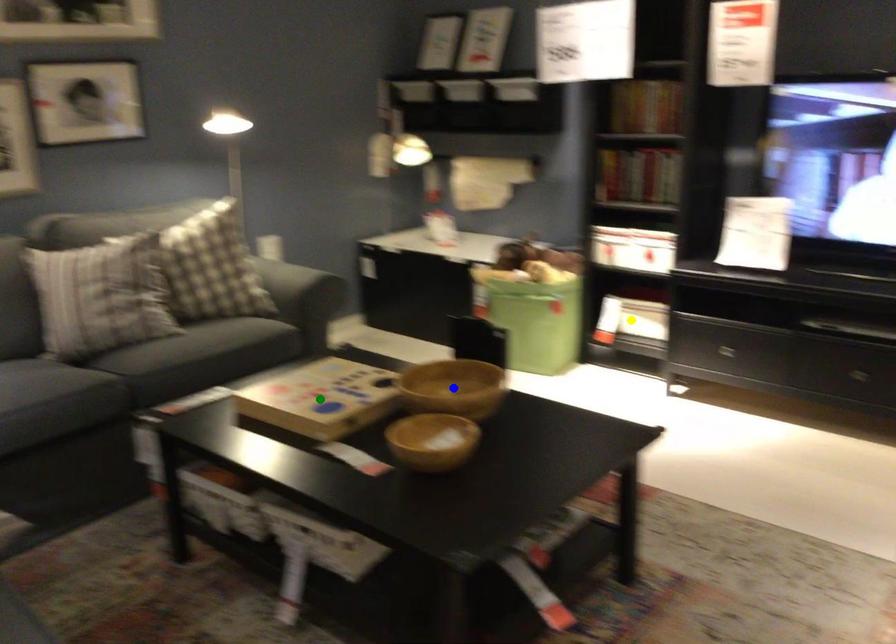
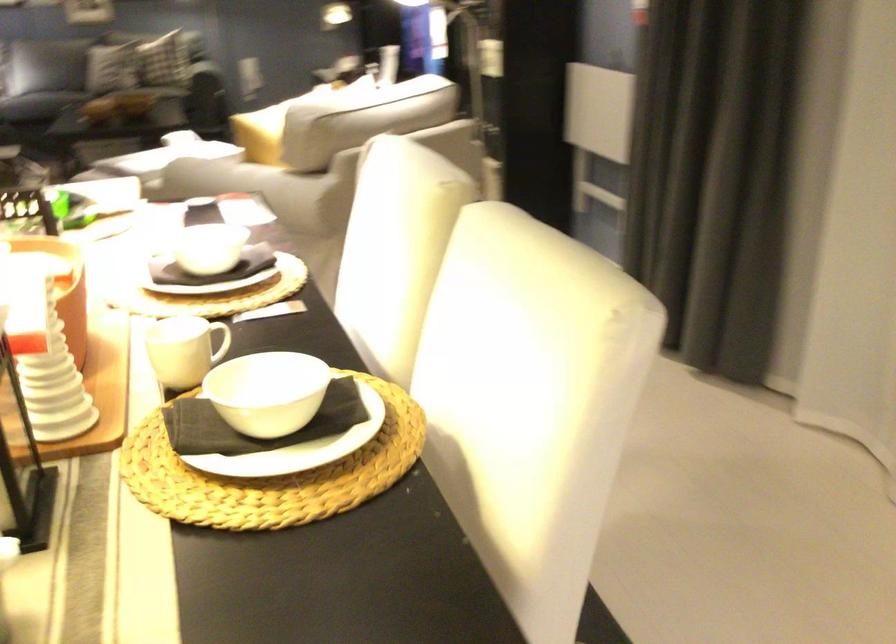
I am providing you with two images of the same scene from different viewpoints. Three points are marked in image1. Which point corresponds to a part or object that is occluded in image2?In image1, three points are marked. Which of them correspond to a part or object that is occluded in image2?Among the three points shown in image1, which one corresponds to a part or object that is no longer visible due to occlusion in image2?

blue point, yellow point, green point